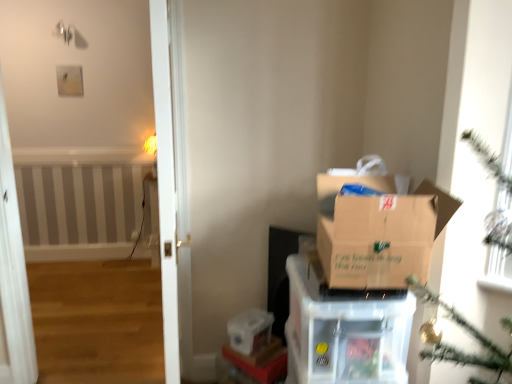
Question: From the image's perspective, is clear plastic container at lower center positioned above or below clear plastic storage box at lower center?

Choices:
 (A) above
 (B) below

Answer: (B)

Question: Is clear plastic container at lower center wider or thinner than clear plastic storage box at lower center?

Choices:
 (A) thin
 (B) wide

Answer: (B)

Question: Which object is positioned farthest from the brown cardboard box at right?

Choices:
 (A) clear plastic storage box at lower center
 (B) brown cardboard box at center
 (C) clear plastic container at lower center

Answer: (C)

Question: Based on their relative distances, which object is nearer to the clear plastic storage box at lower center?

Choices:
 (A) brown cardboard box at right
 (B) brown cardboard box at center
 (C) clear plastic container at lower center

Answer: (C)